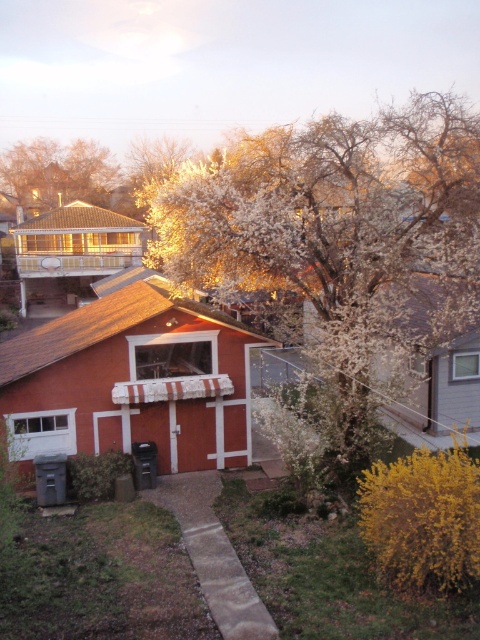
Between point (170, 195) and point (79, 198), which one is positioned in front?

Point (170, 195)

Who is shorter, white blossoming tree at upper center or fluffy white blossoms at upper left?

fluffy white blossoms at upper left is shorter.

The height and width of the screenshot is (640, 480). Find the location of `white blossoming tree at upper center`. white blossoming tree at upper center is located at coordinates (339, 225).

The image size is (480, 640). What do you see at coordinates (132, 380) in the screenshot?
I see `matte red wood shed at center` at bounding box center [132, 380].

Can you confirm if matte red wood shed at center is positioned to the left of fluffy white blossoms at upper left?

Incorrect, matte red wood shed at center is not on the left side of fluffy white blossoms at upper left.

Where is `matte red wood shed at center`? Image resolution: width=480 pixels, height=640 pixels. matte red wood shed at center is located at coordinates (132, 380).

Does point (416, 252) lie in front of point (24, 333)?

Yes, it is in front of point (24, 333).

Is point (368, 138) farther from viewer compared to point (249, 356)?

Yes, point (368, 138) is behind point (249, 356).

Describe the element at coordinates (339, 225) in the screenshot. This screenshot has width=480, height=640. I see `white blossoming tree at upper center` at that location.

Where is `white blossoming tree at upper center`? The width and height of the screenshot is (480, 640). white blossoming tree at upper center is located at coordinates (339, 225).